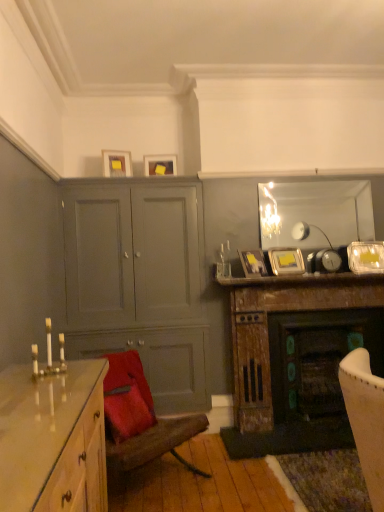
Where is `vacant area located to the right-hand side of gold metallic candle holder at left`? The height and width of the screenshot is (512, 384). vacant area located to the right-hand side of gold metallic candle holder at left is located at coordinates (80, 375).